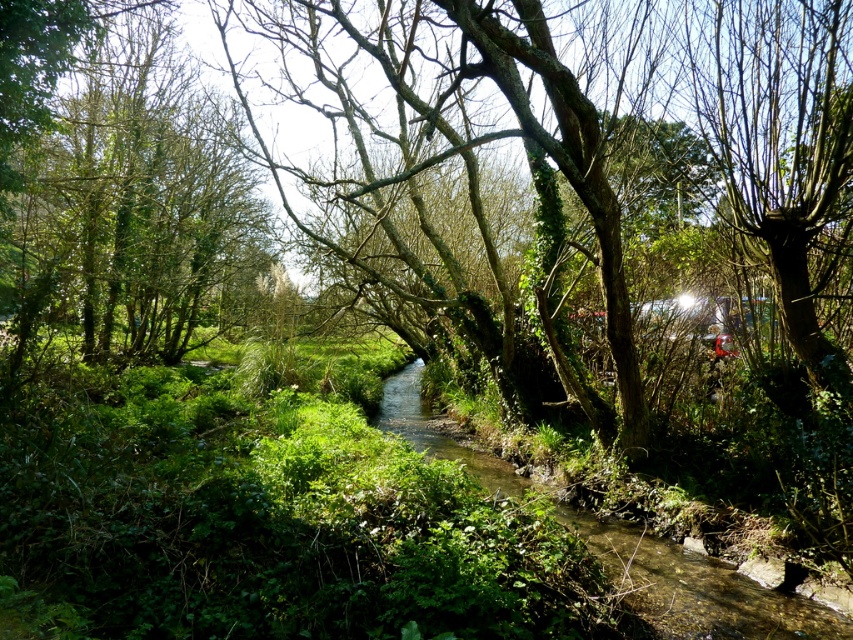
Question: Which point appears closest to the camera in this image?

Choices:
 (A) [390, 426]
 (B) [117, 310]

Answer: (A)

Question: Which point is closer to the camera?

Choices:
 (A) clear water at center
 (B) green leafy tree at left

Answer: (A)

Question: Is green leafy tree at left positioned behind clear water at center?

Choices:
 (A) yes
 (B) no

Answer: (A)

Question: Among these points, which one is farthest from the camera?

Choices:
 (A) (183, 99)
 (B) (822, 620)

Answer: (A)

Question: Is green leafy tree at left to the left of clear water at center from the viewer's perspective?

Choices:
 (A) no
 (B) yes

Answer: (B)

Question: Is green leafy tree at left wider than clear water at center?

Choices:
 (A) yes
 (B) no

Answer: (A)